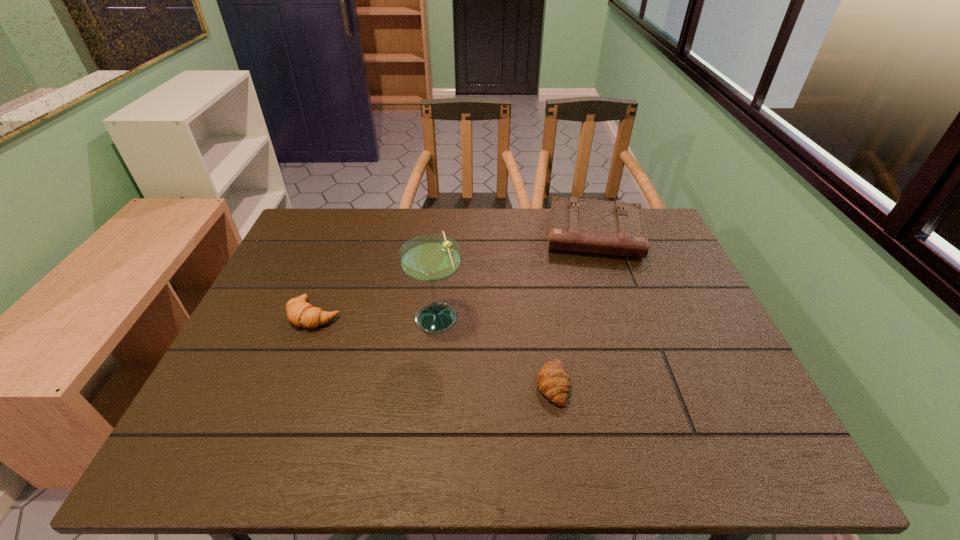
Find the location of `free space between the rightmost object and the martini`. free space between the rightmost object and the martini is located at coordinates (516, 276).

Find the location of `vacant area between the third object from left to right and the third object from right to left`. vacant area between the third object from left to right and the third object from right to left is located at coordinates (494, 350).

Identify which object is the third nearest to the left crescent roll. Please provide its 2D coordinates. Your answer should be formatted as a tuple, i.e. [(x, y)], where the tuple contains the x and y coordinates of a point satisfying the conditions above.

[(616, 228)]

Identify which object is located as the second nearest to the nearer crescent roll. Please provide its 2D coordinates. Your answer should be formatted as a tuple, i.e. [(x, y)], where the tuple contains the x and y coordinates of a point satisfying the conditions above.

[(616, 228)]

Find the location of a particular element. This screenshot has height=540, width=960. free spot that satisfies the following two spatial constraints: 1. on the front side of the leftmost object; 2. on the left side of the tallest object is located at coordinates (314, 317).

In order to click on vacant region that satisfies the following two spatial constraints: 1. on the front side of the farther crescent roll; 2. on the right side of the nearest object in this screenshot , I will do `click(288, 384)`.